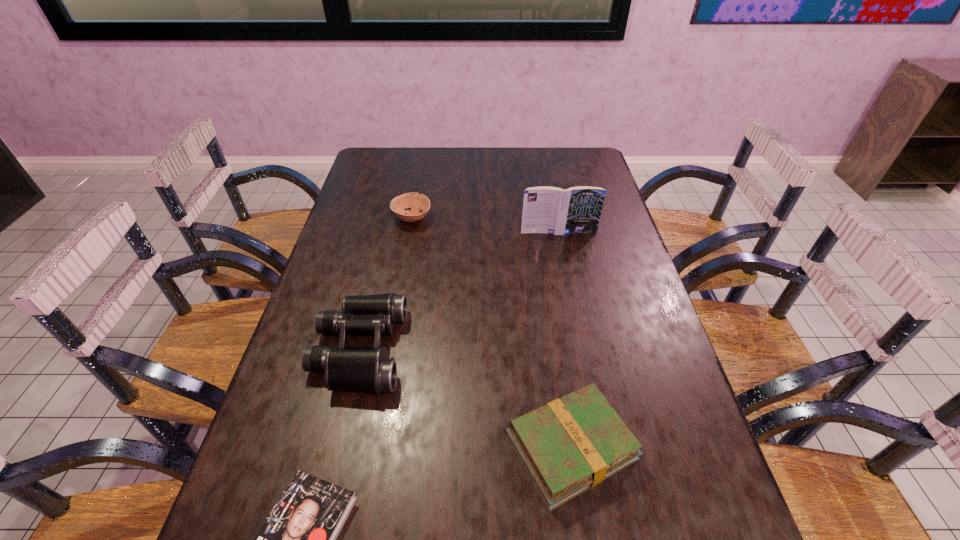
At what (x,y) coordinates should I click in order to perform the action: click on bowl that is positioned at the left edge. Please return your answer as a coordinate pair (x, y). Looking at the image, I should click on (x=417, y=202).

At what (x,y) coordinates should I click in order to perform the action: click on vacant space at the far edge of the desktop. Please return your answer as a coordinate pair (x, y). The image size is (960, 540). Looking at the image, I should click on (492, 154).

Identify the location of blank space at the left edge. (307, 471).

Image resolution: width=960 pixels, height=540 pixels. Find the location of `free space at the right edge of the desktop`. free space at the right edge of the desktop is located at coordinates (653, 468).

In the image, there is a desktop. Where is `vacant space at the far left corner`? vacant space at the far left corner is located at coordinates (375, 171).

Where is `vacant point located between the bowl and the second tallest object`? The image size is (960, 540). vacant point located between the bowl and the second tallest object is located at coordinates (386, 284).

Locate an element on the screen. unoccupied position between the farthest book and the second tallest object is located at coordinates coord(459,291).

Where is `free space between the bowl and the tallest book`? The height and width of the screenshot is (540, 960). free space between the bowl and the tallest book is located at coordinates (485, 225).

The image size is (960, 540). What are the coordinates of `free spot between the farthest book and the bowl` in the screenshot? It's located at (485, 225).

You are a GUI agent. You are given a task and a screenshot of the screen. Output one action in this format:
    pyautogui.click(x=<x>, y=<y>)
    Task: Click on the vacant space in between the binoculars and the bowl
    The image size is (960, 540).
    Given the screenshot: What is the action you would take?
    pyautogui.click(x=386, y=284)